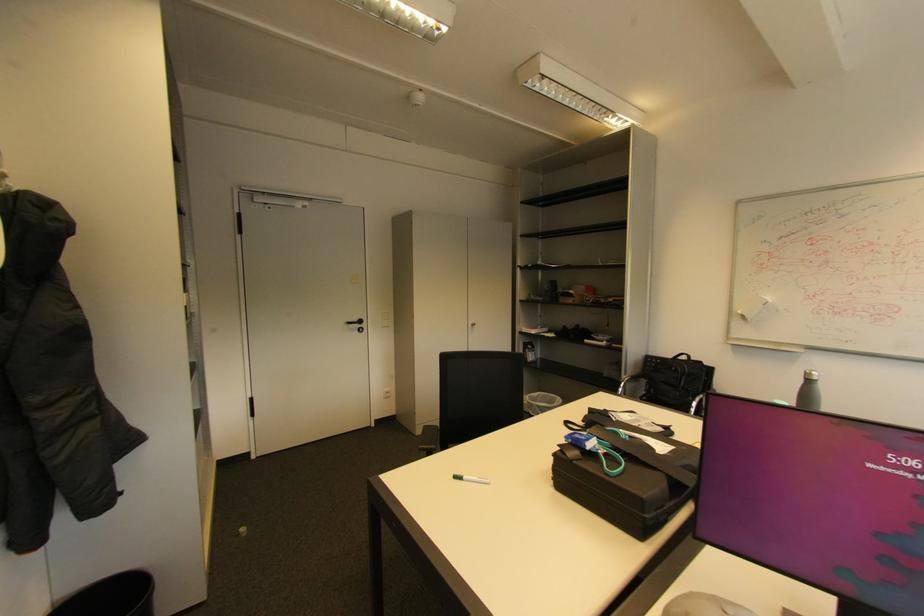
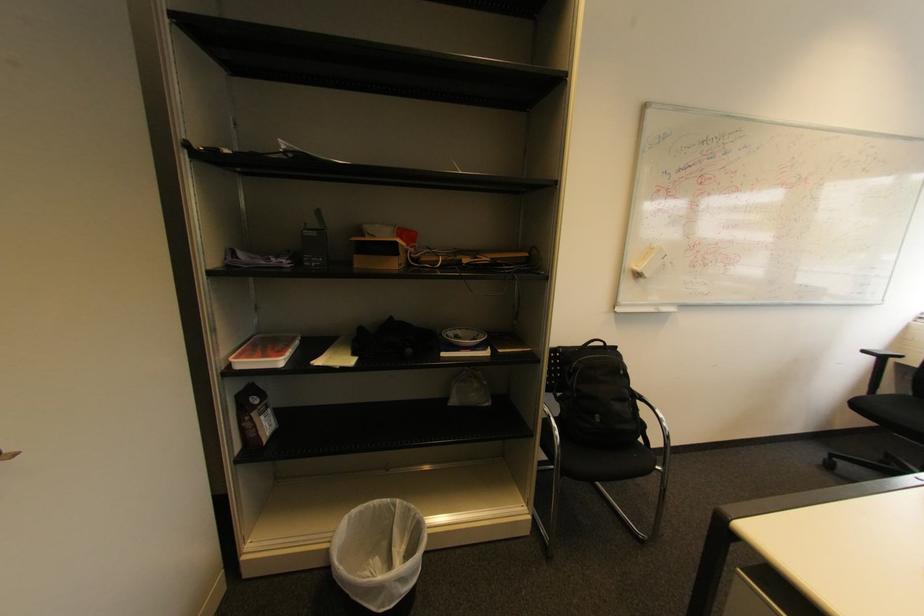
In the second image, find the point that corresponds to pixel 556 397 in the first image.

(380, 507)